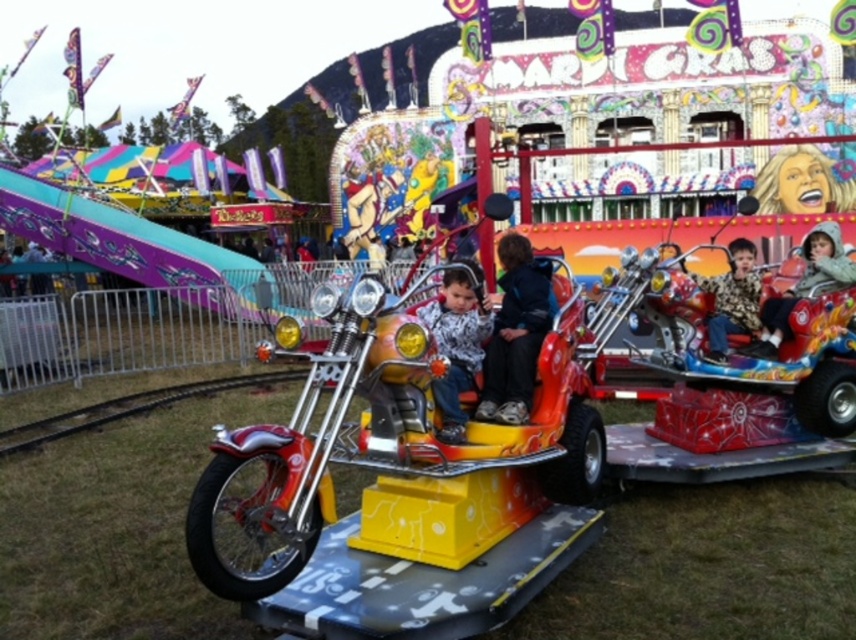
You are a photographer at the fairground. You want to take a photo of the shiny chrome motorcycle at center and the printed fabric shirt at center such that the motorcycle is fully visible without being blocked. Considering their positions, where should you position yourself relative to the two objects?

The shiny chrome motorcycle at center is below the printed fabric shirt at center, so to ensure the motorcycle is fully visible, position yourself so that you look downward from above the printed fabric shirt at center towards the motorcycle below it.

You are standing at the entrance of the carnival and want to locate the matte black jacket at upper right. According to the coordinates provided, where should you look to find it?

The matte black jacket at upper right is located at coordinates point 0.445 on the x axis and 0.940 on the y axis.

You are standing at the entrance of the fairground. You want to locate the shiny chrome motorcycle at center. What is its 2D coordinate position?

The shiny chrome motorcycle at center is located at the 2D coordinate point of [397,483].